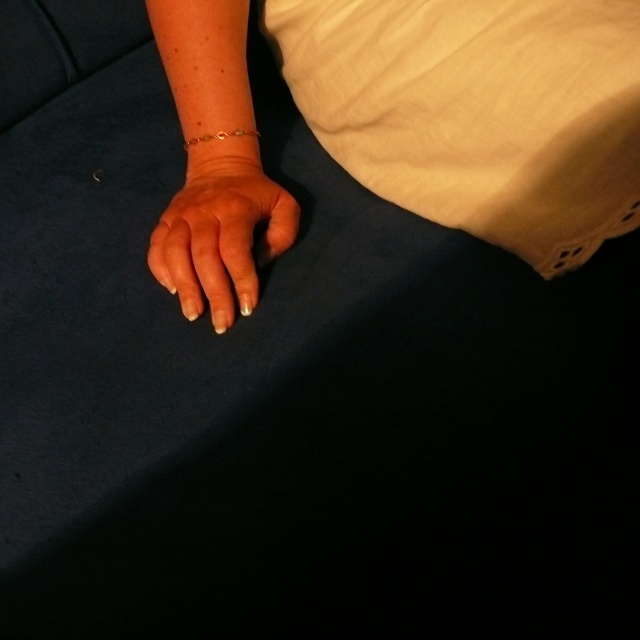
Question: Which object is the closest to the smooth skin hand at center?

Choices:
 (A) gold metallic bracelet at center
 (B) white cotton pillow at upper right

Answer: (A)

Question: Which object is positioned farthest from the gold metallic bracelet at center?

Choices:
 (A) white cotton pillow at upper right
 (B) smooth skin hand at center

Answer: (A)

Question: Can you confirm if smooth skin hand at center is positioned above gold metallic bracelet at center?

Choices:
 (A) no
 (B) yes

Answer: (A)

Question: Is white cotton pillow at upper right further to the viewer compared to smooth skin hand at center?

Choices:
 (A) yes
 (B) no

Answer: (B)

Question: Can you confirm if white cotton pillow at upper right is bigger than gold metallic bracelet at center?

Choices:
 (A) yes
 (B) no

Answer: (A)

Question: Which of the following is the closest to the observer?

Choices:
 (A) (196, 225)
 (B) (465, 218)
 (C) (243, 132)

Answer: (A)